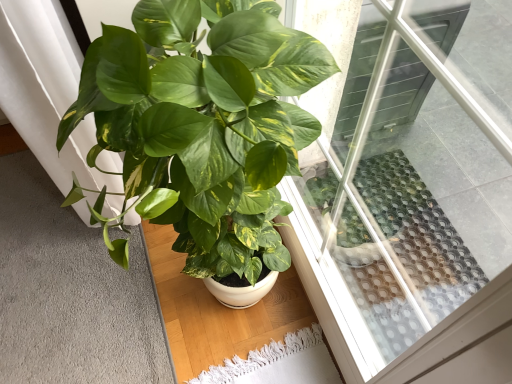
Question: Is green glossy leafy plant at center inside soft gray carpet at lower left?

Choices:
 (A) yes
 (B) no

Answer: (B)

Question: Is soft gray carpet at lower left turned away from green glossy leafy plant at center?

Choices:
 (A) yes
 (B) no

Answer: (B)

Question: From a real-world perspective, does soft gray carpet at lower left stand above green glossy leafy plant at center?

Choices:
 (A) yes
 (B) no

Answer: (B)

Question: Is soft gray carpet at lower left at the left side of green glossy leafy plant at center?

Choices:
 (A) no
 (B) yes

Answer: (B)

Question: Is soft gray carpet at lower left smaller than green glossy leafy plant at center?

Choices:
 (A) no
 (B) yes

Answer: (B)

Question: Can you confirm if soft gray carpet at lower left is shorter than green glossy leafy plant at center?

Choices:
 (A) yes
 (B) no

Answer: (A)

Question: Can you confirm if transparent glass window at upper center is bigger than soft gray carpet at lower left?

Choices:
 (A) no
 (B) yes

Answer: (B)

Question: Does transparent glass window at upper center turn towards soft gray carpet at lower left?

Choices:
 (A) yes
 (B) no

Answer: (A)

Question: From the image's perspective, is transparent glass window at upper center above soft gray carpet at lower left?

Choices:
 (A) no
 (B) yes

Answer: (B)

Question: Is transparent glass window at upper center positioned with its back to soft gray carpet at lower left?

Choices:
 (A) no
 (B) yes

Answer: (A)

Question: Does transparent glass window at upper center have a lesser height compared to soft gray carpet at lower left?

Choices:
 (A) no
 (B) yes

Answer: (A)

Question: From a real-world perspective, is transparent glass window at upper center located higher than soft gray carpet at lower left?

Choices:
 (A) no
 (B) yes

Answer: (B)

Question: Does transparent glass window at upper center have a smaller size compared to green glossy leafy plant at center?

Choices:
 (A) yes
 (B) no

Answer: (A)